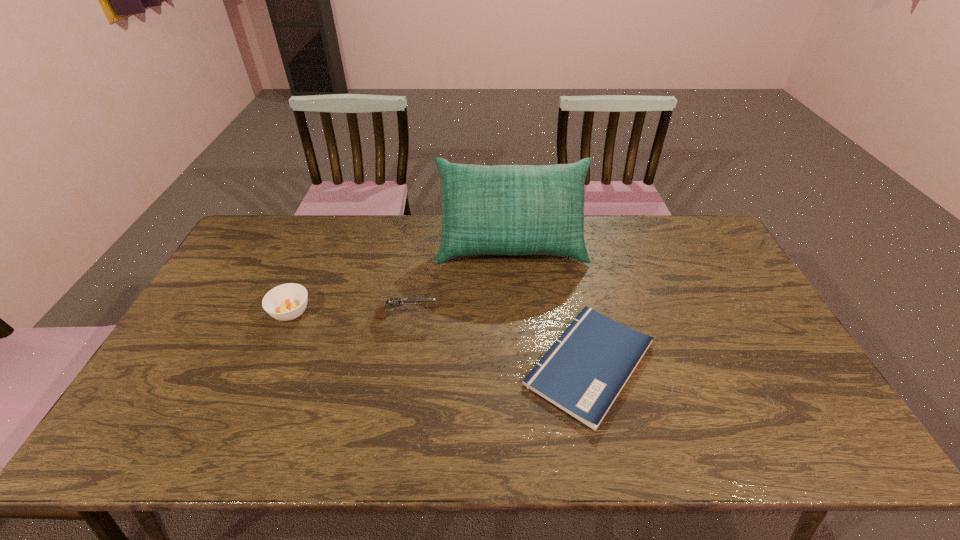
This screenshot has height=540, width=960. Identify the location of object situated at the far edge. (503, 209).

Identify the location of object at the near edge. pyautogui.click(x=584, y=371).

Find the location of a particular element. The image size is (960, 540). free space at the far edge of the desktop is located at coordinates (402, 217).

Image resolution: width=960 pixels, height=540 pixels. Find the location of `vacant region at the near edge of the desktop`. vacant region at the near edge of the desktop is located at coordinates (204, 455).

The width and height of the screenshot is (960, 540). What are the coordinates of `free space at the left edge` in the screenshot? It's located at (263, 269).

The image size is (960, 540). Find the location of `free space at the right edge`. free space at the right edge is located at coordinates (730, 261).

In the image, there is a desktop. Identify the location of free region at the far left corner. The width and height of the screenshot is (960, 540). (254, 242).

The width and height of the screenshot is (960, 540). I want to click on vacant region at the far right corner of the desktop, so click(677, 228).

Locate an element on the screen. This screenshot has width=960, height=540. free space between the cushion and the shortest object is located at coordinates (550, 305).

What are the coordinates of `free space between the shortest object and the soup bowl` in the screenshot? It's located at click(x=440, y=338).